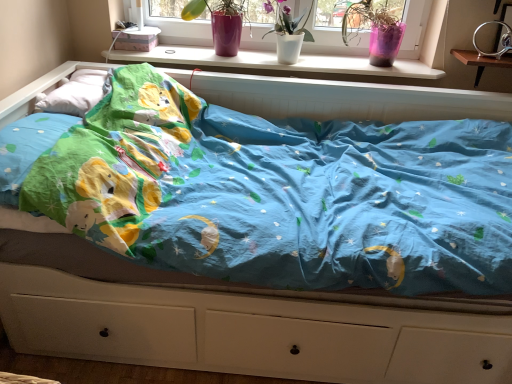
The width and height of the screenshot is (512, 384). I want to click on free region under pink plastic pot at upper right, marked as the 3th floral arrangement in a left-to-right arrangement (from a real-world perspective), so click(357, 63).